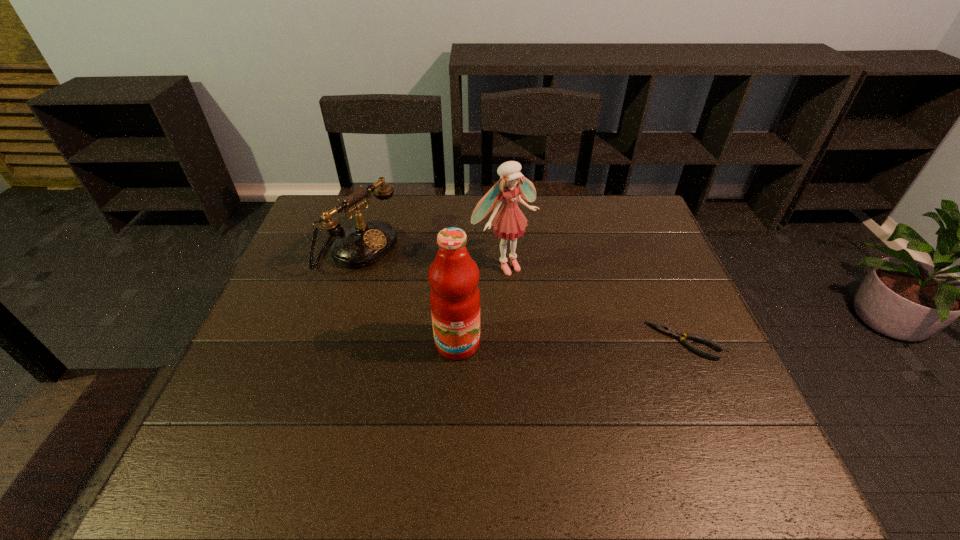
This screenshot has height=540, width=960. Identify the location of empty space between the rightmost object and the leftmost object. (521, 295).

This screenshot has height=540, width=960. I want to click on free spot between the pliers and the telephone, so click(x=521, y=295).

At what (x,y) coordinates should I click in order to perform the action: click on unoccupied area between the doll and the shortest object. Please return your answer as a coordinate pair (x, y). Looking at the image, I should click on (593, 302).

The height and width of the screenshot is (540, 960). I want to click on vacant point located between the doll and the leftmost object, so click(x=431, y=257).

This screenshot has height=540, width=960. In order to click on free spot between the doll and the shortest object in this screenshot , I will do `click(593, 302)`.

Find the location of a particular element. This screenshot has width=960, height=540. free point between the fruit juice and the doll is located at coordinates (481, 303).

Locate an element on the screen. object that is the second closest one to the fruit juice is located at coordinates (364, 244).

Identify which object is the third closest to the third tallest object. Please provide its 2D coordinates. Your answer should be formatted as a tuple, i.e. [(x, y)], where the tuple contains the x and y coordinates of a point satisfying the conditions above.

[(675, 334)]

Locate an element on the screen. vacant region that satisfies the following two spatial constraints: 1. on the front side of the rightmost object; 2. on the right side of the doll is located at coordinates (508, 341).